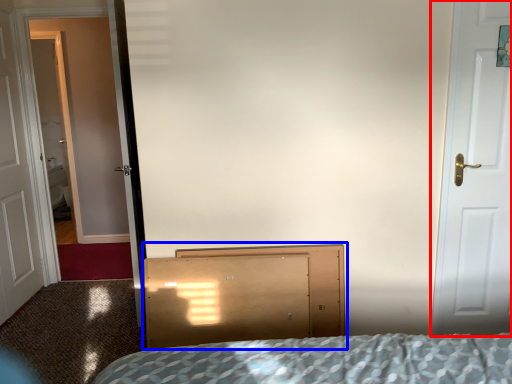
Question: Which object appears closest to the camera in this image, door (highlighted by a red box) or dresser (highlighted by a blue box)?

Choices:
 (A) door
 (B) dresser

Answer: (A)